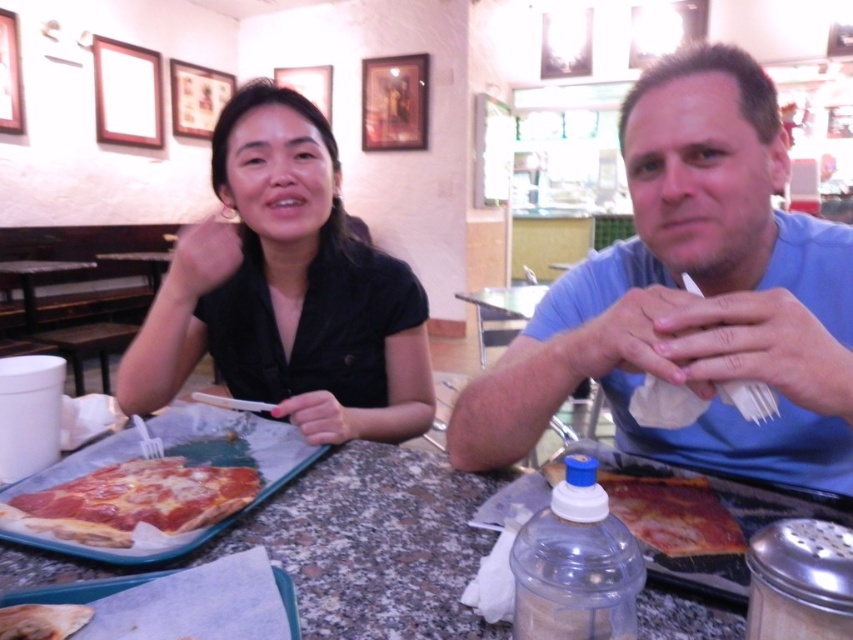
Can you confirm if blue cotton shirt at center is positioned to the right of granite table at center?

Correct, you'll find blue cotton shirt at center to the right of granite table at center.

Who is shorter, blue cotton shirt at center or granite table at center?

With less height is granite table at center.

Locate an element on the screen. This screenshot has width=853, height=640. blue cotton shirt at center is located at coordinates tap(692, 296).

Which of these two, blue cotton shirt at center or black matte shirt at center, stands taller?

black matte shirt at center

Is point (712, 467) closer to camera compared to point (422, 337)?

Yes, it is in front of point (422, 337).

Is point (482, 372) farther from camera compared to point (231, 193)?

No.

Image resolution: width=853 pixels, height=640 pixels. I want to click on blue cotton shirt at center, so [x=692, y=296].

The image size is (853, 640). What do you see at coordinates (692, 296) in the screenshot?
I see `blue cotton shirt at center` at bounding box center [692, 296].

Measure the distance between blue cotton shirt at center and camera.

blue cotton shirt at center is 51.42 centimeters away from camera.

Where is `blue cotton shirt at center`? This screenshot has height=640, width=853. blue cotton shirt at center is located at coordinates (692, 296).